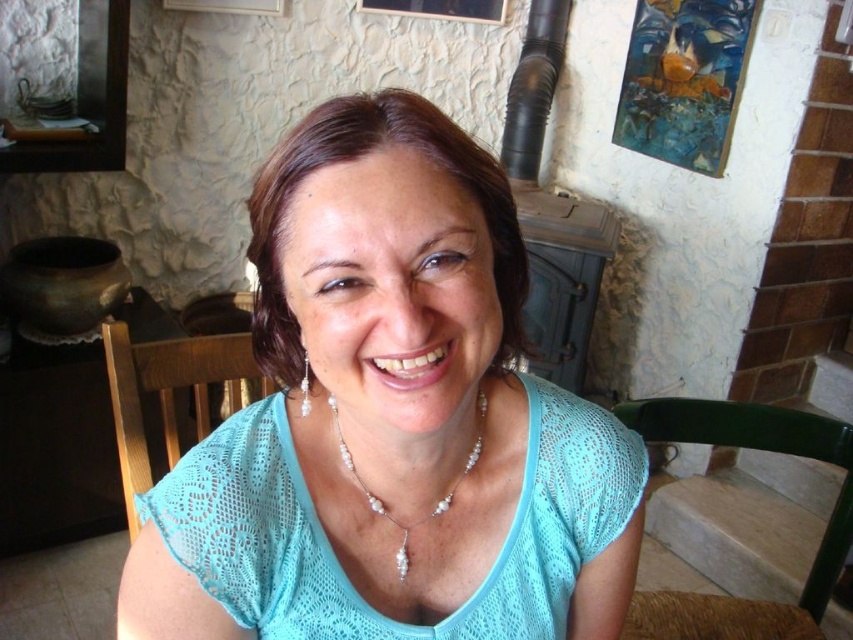
Between light blue lace shirt at center and green plastic chair at lower right, which one appears on the right side from the viewer's perspective?

green plastic chair at lower right

This screenshot has width=853, height=640. Describe the element at coordinates (390, 420) in the screenshot. I see `light blue lace shirt at center` at that location.

Does point (312, 316) lie behind point (630, 410)?

No, (312, 316) is in front of (630, 410).

What are the coordinates of `light blue lace shirt at center` in the screenshot? It's located at (390, 420).

Is point (57, 524) behind point (724, 436)?

Yes.

Describe the element at coordinates (56, 448) in the screenshot. I see `brown wooden table at left` at that location.

Is point (33, 433) closer to viewer compared to point (618, 412)?

No.

Find the location of a particular element. brown wooden table at left is located at coordinates (56, 448).

Is brown wooden table at left behind wooden chair at center?

Result: Yes, brown wooden table at left is further from the viewer.

Which of these two, brown wooden table at left or wooden chair at center, stands shorter?

wooden chair at center is shorter.

Find the location of a particular element. brown wooden table at left is located at coordinates (56, 448).